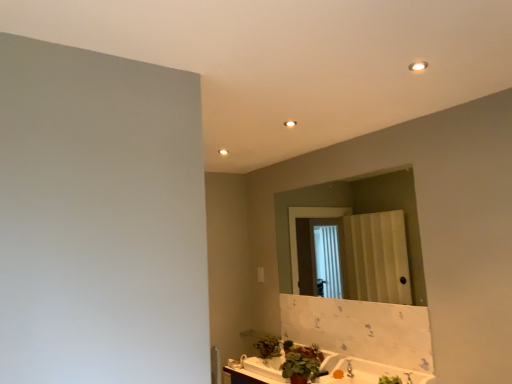
Question: Is green matte plant at lower center, acting as the second plant starting from the back, taller than matte glass mirror at center?

Choices:
 (A) yes
 (B) no

Answer: (B)

Question: Is green matte plant at lower center, the 2th plant in the front-to-back sequence, smaller than matte glass mirror at center?

Choices:
 (A) yes
 (B) no

Answer: (A)

Question: From the image's perspective, would you say green matte plant at lower center, acting as the second plant starting from the back, is shown under matte glass mirror at center?

Choices:
 (A) no
 (B) yes

Answer: (B)

Question: From a real-world perspective, is green matte plant at lower center, the 2th plant in the front-to-back sequence, physically below matte glass mirror at center?

Choices:
 (A) no
 (B) yes

Answer: (B)

Question: Is green matte plant at lower center, acting as the second plant starting from the back, oriented towards matte glass mirror at center?

Choices:
 (A) yes
 (B) no

Answer: (B)

Question: Considering the relative positions of green matte plant at lower center, acting as the second plant starting from the back, and matte glass mirror at center in the image provided, is green matte plant at lower center, acting as the second plant starting from the back, to the left of matte glass mirror at center from the viewer's perspective?

Choices:
 (A) yes
 (B) no

Answer: (A)

Question: Is matte glass mirror at center next to green matte plant at lower center, the 2th plant in the front-to-back sequence?

Choices:
 (A) no
 (B) yes

Answer: (A)

Question: Can green matte plant at lower center, the 2th plant in the front-to-back sequence, be found inside matte glass mirror at center?

Choices:
 (A) no
 (B) yes

Answer: (A)

Question: From the image's perspective, does matte glass mirror at center appear higher than green matte plant at lower center, the 2th plant in the front-to-back sequence?

Choices:
 (A) yes
 (B) no

Answer: (A)

Question: Is matte glass mirror at center taller than green matte plant at lower center, acting as the second plant starting from the back?

Choices:
 (A) yes
 (B) no

Answer: (A)

Question: Is matte glass mirror at center to the right of green matte plant at lower center, the 2th plant in the front-to-back sequence, from the viewer's perspective?

Choices:
 (A) yes
 (B) no

Answer: (A)

Question: Can you confirm if matte glass mirror at center is positioned to the left of green matte plant at lower center, acting as the second plant starting from the back?

Choices:
 (A) yes
 (B) no

Answer: (B)

Question: Is white glossy countertop at lower center facing towards green matte plant at lower center, the 2th plant in the front-to-back sequence?

Choices:
 (A) yes
 (B) no

Answer: (B)